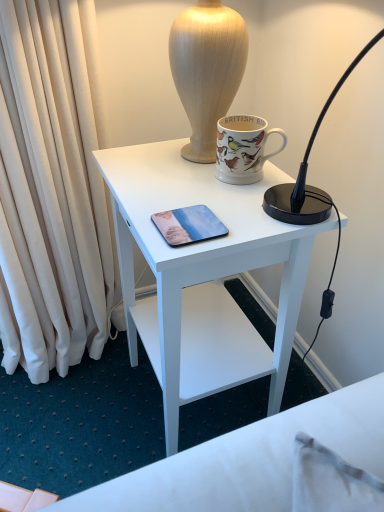
The width and height of the screenshot is (384, 512). What are the coordinates of `vacant area that is in front of matte ceramic mug at upper center` in the screenshot? It's located at (258, 208).